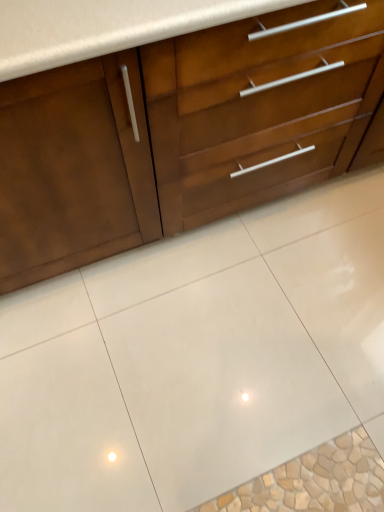
Question: Considering the relative sizes of matte wood cabinet at upper left and white glossy tile at center in the image provided, is matte wood cabinet at upper left taller than white glossy tile at center?

Choices:
 (A) yes
 (B) no

Answer: (A)

Question: Is matte wood cabinet at upper left at the left side of white glossy tile at center?

Choices:
 (A) no
 (B) yes

Answer: (B)

Question: Considering the relative sizes of matte wood cabinet at upper left and white glossy tile at center in the image provided, is matte wood cabinet at upper left wider than white glossy tile at center?

Choices:
 (A) no
 (B) yes

Answer: (A)

Question: Is the depth of matte wood cabinet at upper left less than that of white glossy tile at center?

Choices:
 (A) no
 (B) yes

Answer: (B)

Question: Is matte wood cabinet at upper left not near white glossy tile at center?

Choices:
 (A) no
 (B) yes

Answer: (A)

Question: Is matte wood cabinet at upper left oriented towards white glossy tile at center?

Choices:
 (A) no
 (B) yes

Answer: (B)

Question: Considering the relative positions of white glossy tile at center and matte wood cabinet at upper left in the image provided, is white glossy tile at center to the right of matte wood cabinet at upper left from the viewer's perspective?

Choices:
 (A) no
 (B) yes

Answer: (B)

Question: Does white glossy tile at center come behind matte wood cabinet at upper left?

Choices:
 (A) no
 (B) yes

Answer: (B)

Question: From a real-world perspective, is white glossy tile at center positioned over matte wood cabinet at upper left based on gravity?

Choices:
 (A) no
 (B) yes

Answer: (A)

Question: Does white glossy tile at center have a larger size compared to matte wood cabinet at upper left?

Choices:
 (A) yes
 (B) no

Answer: (B)

Question: Is matte wood cabinet at upper left inside white glossy tile at center?

Choices:
 (A) no
 (B) yes

Answer: (A)

Question: From a real-world perspective, is white glossy tile at center physically below matte wood cabinet at upper left?

Choices:
 (A) no
 (B) yes

Answer: (B)

Question: Is white glossy tile at center wider or thinner than matte wood cabinet at upper left?

Choices:
 (A) wide
 (B) thin

Answer: (A)